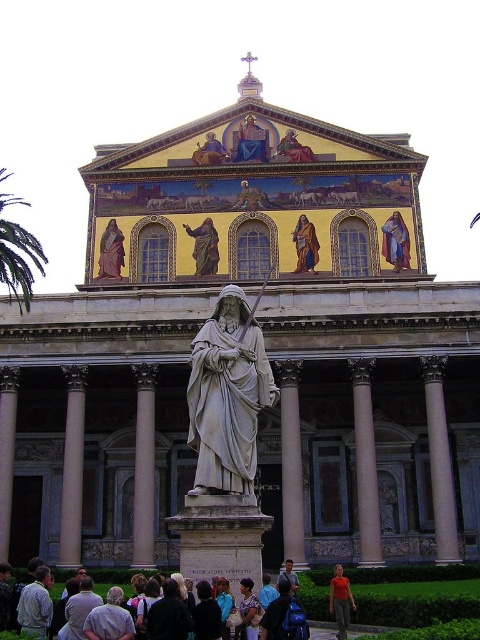
Looking at this image, you are an architect visiting this basilica and notice the white marble column at center and the golden textured robe at center. Which object would require more space to accommodate in a replica? Explain your reasoning based on their sizes.

The white marble column at center is bigger than the golden textured robe at center, so it would require more space to accommodate in a replica.

You are an architect examining the basilica facade. You notice the white marble pillar at center and the matte gold statue at center. Which object is located to the left of the other?

The white marble pillar at center is positioned on the left side of matte gold statue at center.

You are a tourist standing at the entrance of the cathedral and want to take a photo of the matte white statue at center. Given that your camera has a maximum zoom range of 100 meters, will you be able to capture the entire statue in your photo without moving closer?

The matte white statue at center is 82.41 meters away from the camera. Since your camera can zoom up to 100 meters, you can capture the entire statue in your photo without moving closer.